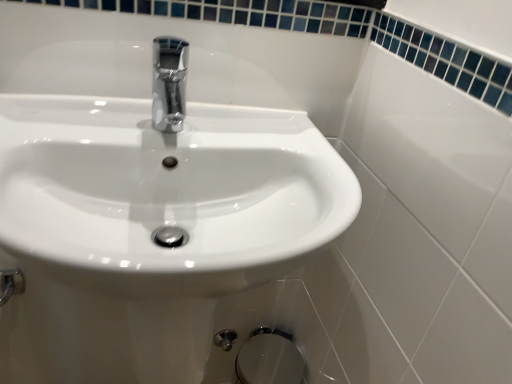
Image resolution: width=512 pixels, height=384 pixels. What are the coordinates of `unoccupied region to the right of chrome metallic faucet at center` in the screenshot? It's located at (260, 139).